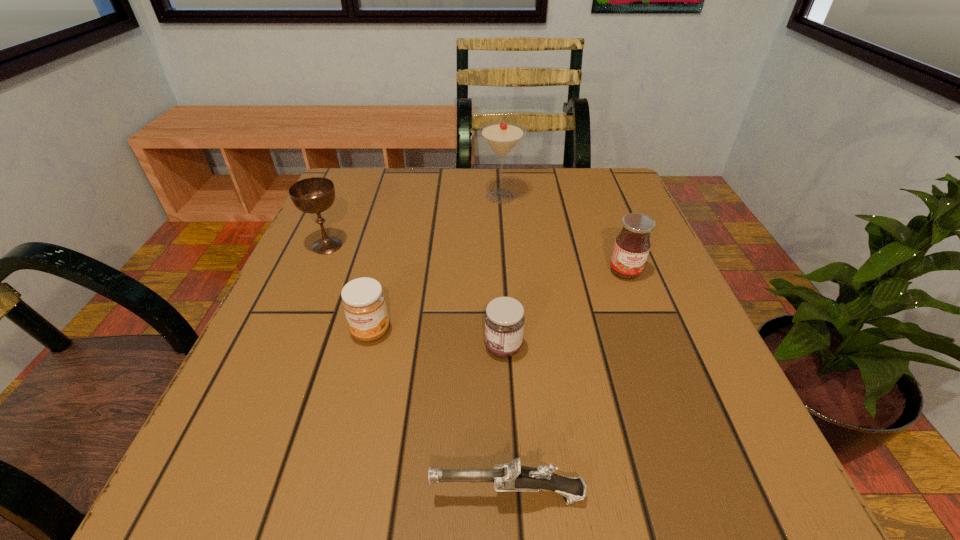
Where is `free space that is in between the second jam from right to left and the fifth nearest object`? The height and width of the screenshot is (540, 960). free space that is in between the second jam from right to left and the fifth nearest object is located at coordinates [x=416, y=296].

The image size is (960, 540). Identify the location of free space between the martini and the rightmost object. (563, 234).

This screenshot has height=540, width=960. Identify the location of free area in between the third farthest object and the nearest object. (566, 383).

Locate an element on the screen. free spot between the second farthest object and the gun is located at coordinates click(418, 370).

Identify the location of unoccupied area between the gun and the fourth shortest object. (566, 383).

Locate an element on the screen. The height and width of the screenshot is (540, 960). empty space that is in between the second jam from right to left and the fourth shortest object is located at coordinates (564, 309).

At what (x,y) coordinates should I click in order to perform the action: click on empty space between the second jam from left to right and the fifth object from right to left. Please return your answer as a coordinate pair (x, y). Looking at the image, I should click on (437, 339).

Select which object appears as the fourth closest to the gun. Please provide its 2D coordinates. Your answer should be formatted as a tuple, i.e. [(x, y)], where the tuple contains the x and y coordinates of a point satisfying the conditions above.

[(312, 195)]

Identify the location of object that ranks as the third closest to the fourth shortest object. Image resolution: width=960 pixels, height=540 pixels. (511, 477).

Identify the location of jam that is the closest to the chalice. The image size is (960, 540). (363, 300).